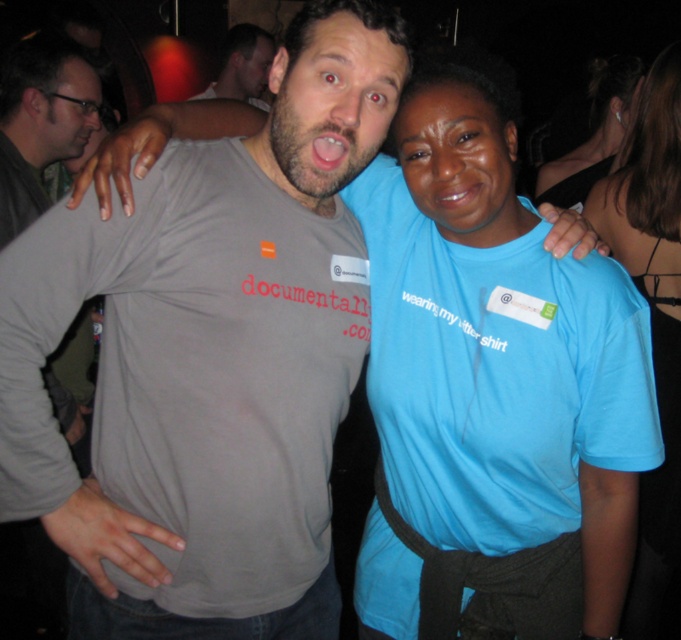
Question: Is gray matte t-shirt at left bigger than blue fabric shirt at upper center?

Choices:
 (A) yes
 (B) no

Answer: (B)

Question: Can you confirm if blue cotton shirt at center is positioned below blue fabric shirt at upper center?

Choices:
 (A) yes
 (B) no

Answer: (A)

Question: Which object is closer to the camera taking this photo?

Choices:
 (A) blue fabric shirt at upper center
 (B) gray matte t-shirt at left

Answer: (B)

Question: Is the position of blue cotton shirt at center more distant than that of gray matte t-shirt at left?

Choices:
 (A) yes
 (B) no

Answer: (A)

Question: Which object is positioned farthest from the gray matte t-shirt at left?

Choices:
 (A) blue cotton shirt at center
 (B) matte gray t-shirt at upper center

Answer: (B)

Question: Which object is closer to the camera taking this photo?

Choices:
 (A) gray matte t-shirt at left
 (B) blue fabric shirt at upper center

Answer: (A)